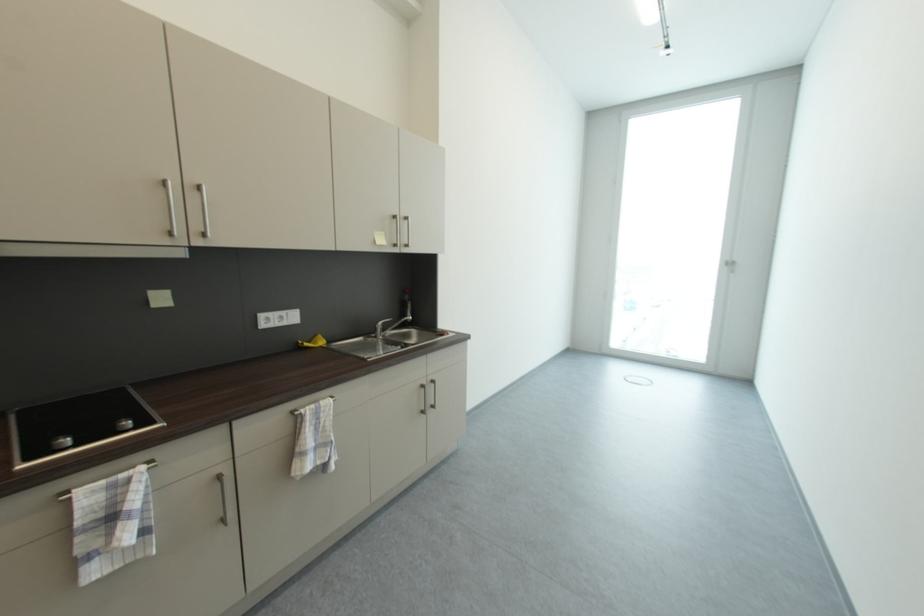
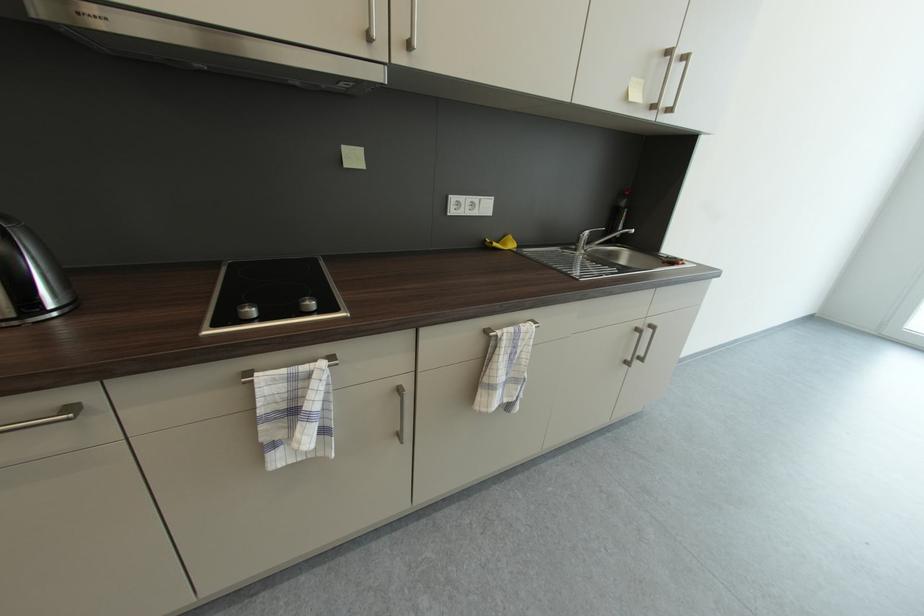
Based on the continuous images, in which direction is the camera rotating?

The camera rotated toward left-down.